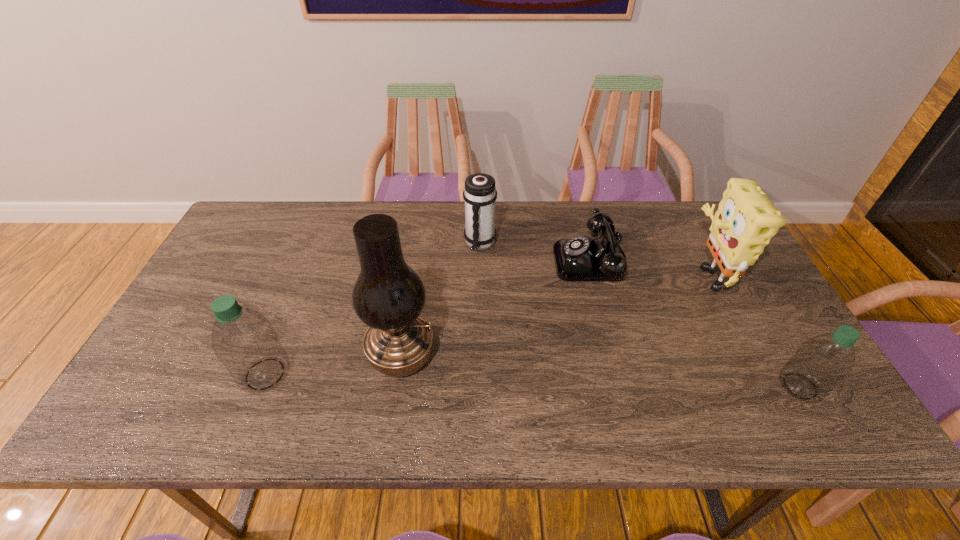
Locate an element on the screen. This screenshot has width=960, height=540. the taller water bottle is located at coordinates (243, 340).

The image size is (960, 540). I want to click on the leftmost object, so click(x=243, y=340).

At what (x,y) coordinates should I click in order to perform the action: click on the shorter water bottle. Please return your answer as a coordinate pair (x, y). Looking at the image, I should click on (822, 362).

Identify the location of sponge. (746, 220).

Find the location of a particular element. thermos bottle is located at coordinates click(x=479, y=194).

This screenshot has width=960, height=540. Find the location of `the third object from right to left`. the third object from right to left is located at coordinates (580, 258).

Where is `telephone`? This screenshot has height=540, width=960. telephone is located at coordinates (580, 258).

The height and width of the screenshot is (540, 960). Find the location of `the tallest object`. the tallest object is located at coordinates (388, 296).

The image size is (960, 540). What are the coordinates of `the fifth object from right to left` in the screenshot? It's located at (388, 296).

Where is `vacant space situated 0.230m on the right of the leftmost object`? This screenshot has height=540, width=960. vacant space situated 0.230m on the right of the leftmost object is located at coordinates (389, 374).